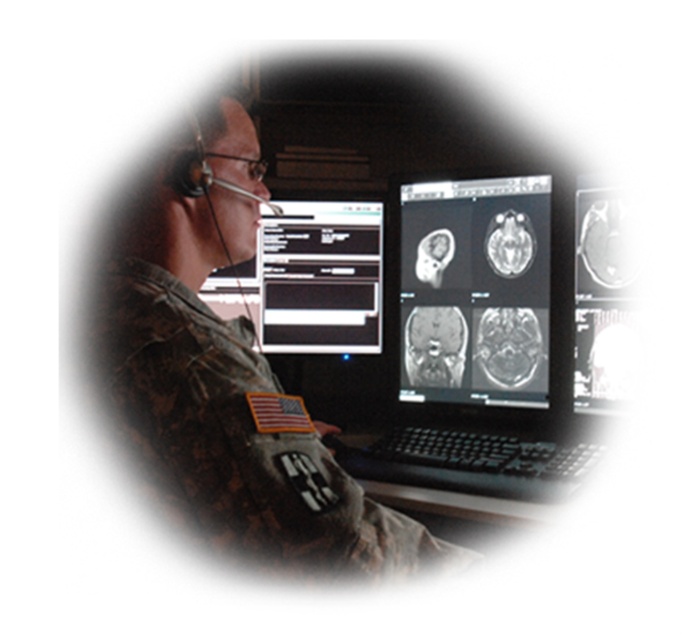
Based on the photo, you are a military medic reviewing the scans on the laptop. You notice the black matte brain scan at center and the black glossy text box at center. Which object is wider?

The black glossy text box at center is wider than the black matte brain scan at center.

You are a drone operator analyzing the image. You need to determine which of the two points, point [421,556] or point [284,305], is closer to your camera. Which one is closer?

Point [421,556] is closer to the camera than point [284,305].

You are a technician trying to adjust the lighting in the room to better view both the black matte brain scan at center and the black glossy text box at center. Since both are at the center, which one would appear brighter when the lights are turned up?

The black glossy text box at center would appear brighter when the lights are turned up because it is farther from the viewer compared to the black matte brain scan at center.